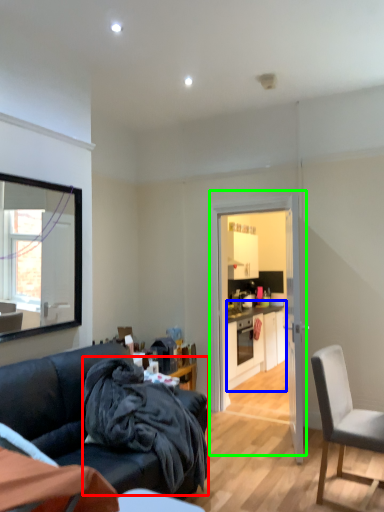
Question: Which object is positioned farthest from blanket (highlighted by a red box)? Select from cabinetry (highlighted by a blue box) and door (highlighted by a green box).

Choices:
 (A) cabinetry
 (B) door

Answer: (A)